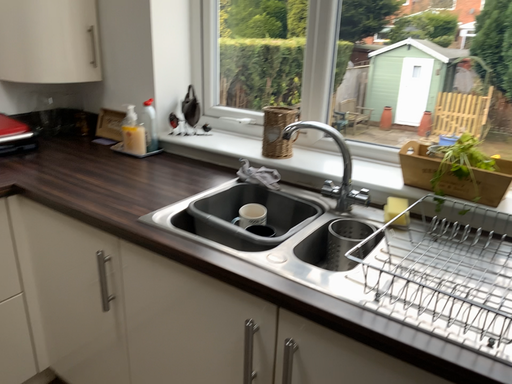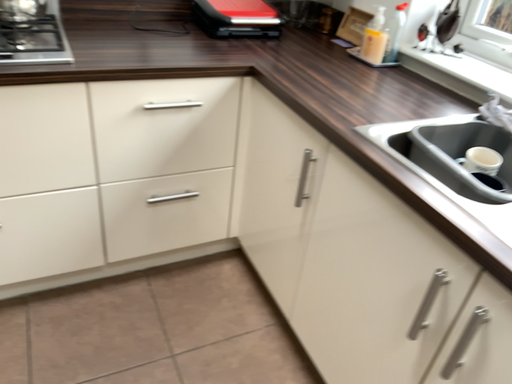
Question: How did the camera likely rotate when shooting the video?

Choices:
 (A) rotated left
 (B) rotated right

Answer: (A)